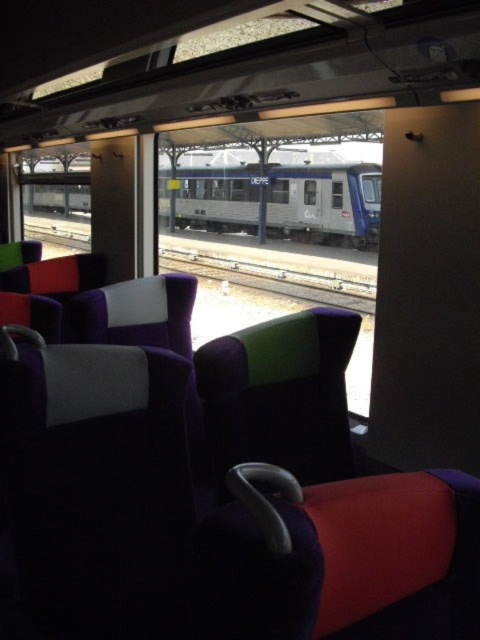
Question: Which of the following is the farthest from the observer?

Choices:
 (A) metal train track at center
 (B) purple fabric seat at center
 (C) velvet green armrest at center
 (D) silver metallic train at center

Answer: (A)

Question: Can you confirm if velvet green armrest at center is wider than metal train track at center?

Choices:
 (A) yes
 (B) no

Answer: (B)

Question: Which point appears closest to the camera in this image?

Choices:
 (A) (298, 182)
 (B) (81, 541)
 (C) (276, 380)
 (D) (345, 291)

Answer: (B)

Question: Does purple fabric seat at center have a lesser width compared to metal train track at center?

Choices:
 (A) no
 (B) yes

Answer: (B)

Question: Does purple fabric seat at center appear on the right side of metal train track at center?

Choices:
 (A) no
 (B) yes

Answer: (B)

Question: Considering the real-world distances, which object is farthest from the velvet green armrest at center?

Choices:
 (A) silver metallic train at center
 (B) metal train track at center
 (C) purple fabric seat at center

Answer: (B)